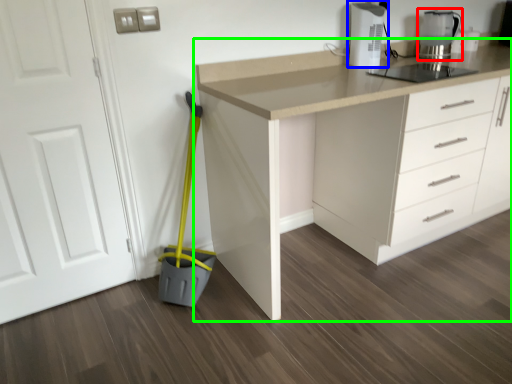
Question: Considering the real-world distances, which object is closest to kitchen appliance (highlighted by a red box)? home appliance (highlighted by a blue box) or countertop (highlighted by a green box).

Choices:
 (A) home appliance
 (B) countertop

Answer: (A)